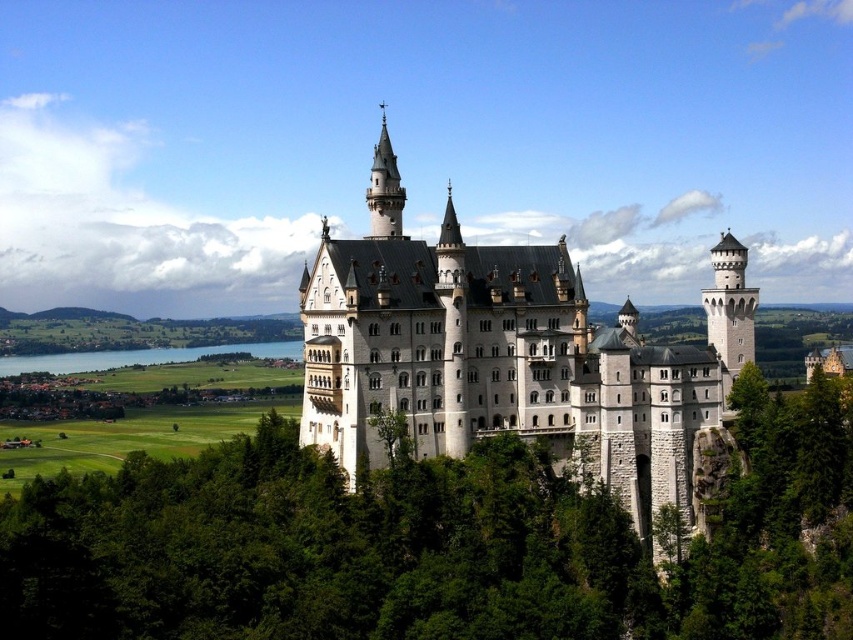
Is white stone castle at center positioned in front of blue water at lower left?

That is True.

This screenshot has height=640, width=853. Identify the location of white stone castle at center. (511, 356).

Is point (527, 394) more distant than point (216, 353)?

No.

At what (x,y) coordinates should I click in order to perform the action: click on white stone castle at center. Please return your answer as a coordinate pair (x, y). This screenshot has width=853, height=640. Looking at the image, I should click on (511, 356).

Which is below, green leafy tree at center or white stone castle at center?

Positioned lower is green leafy tree at center.

Is green leafy tree at center bigger than white stone castle at center?

No, green leafy tree at center is not bigger than white stone castle at center.

What do you see at coordinates (434, 544) in the screenshot?
I see `green leafy tree at center` at bounding box center [434, 544].

At what (x,y) coordinates should I click in order to perform the action: click on green leafy tree at center. Please return your answer as a coordinate pair (x, y). The width and height of the screenshot is (853, 640). Looking at the image, I should click on (434, 544).

Who is higher up, green leafy tree at center or blue water at lower left?

blue water at lower left

Is green leafy tree at center to the left of blue water at lower left from the viewer's perspective?

No, green leafy tree at center is not to the left of blue water at lower left.

Image resolution: width=853 pixels, height=640 pixels. What do you see at coordinates (434, 544) in the screenshot?
I see `green leafy tree at center` at bounding box center [434, 544].

The width and height of the screenshot is (853, 640). I want to click on green leafy tree at center, so click(434, 544).